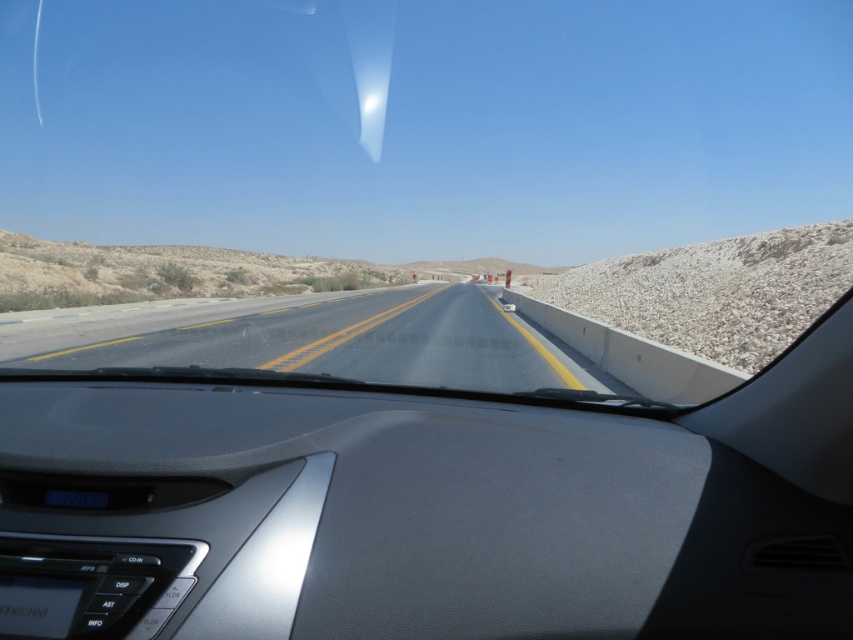
Consider the image. You are driving a car and want to know the position of the smooth asphalt highway at center relative to the white gravel at right. Which one is lower in the image?

The smooth asphalt highway at center is located below white gravel at right, so the highway is lower in the image.

You are driving a car and looking at the road ahead. There are two points marked on the road ahead of you. The first point is at coordinates point (527, 364) and the second point is at point (711, 269). Which point is closer to your car?

Point (527, 364) is closer to the camera than point (711, 269).

You are a driver navigating a straight highway. Your GPS shows a point at coordinates [337,340]. Based on the scene, what does this point likely represent on the road?

The point at coordinates [337,340] corresponds to the smooth asphalt highway at center, indicating that the GPS location is on the central part of the road.